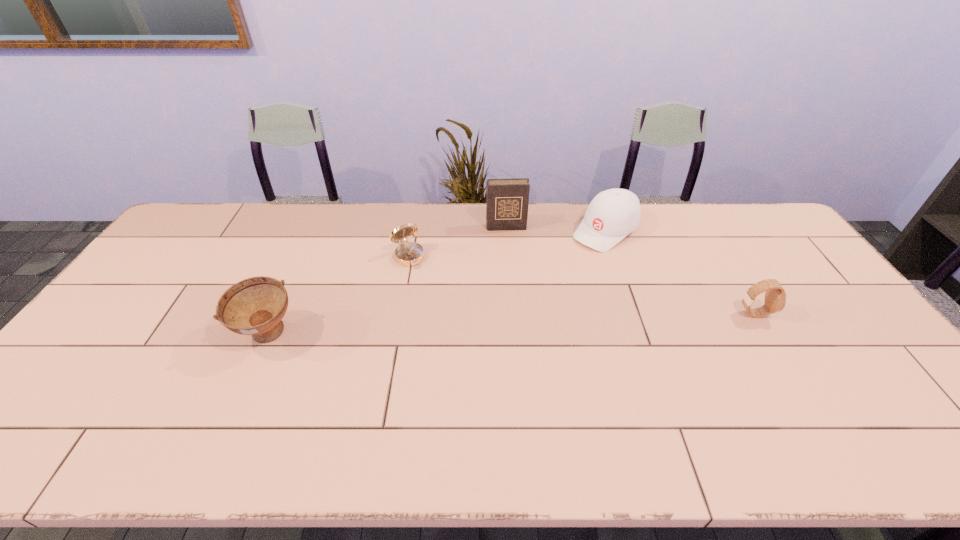
Locate an element on the screen. This screenshot has height=540, width=960. free space on the desktop that is between the soup bowl and the watch and is positioned with the dial facing the compass is located at coordinates (457, 327).

Locate an element on the screen. free spot on the desktop that is between the leftmost object and the watch and is positioned on the front-facing side of the baseball cap is located at coordinates (487, 326).

The width and height of the screenshot is (960, 540). Find the location of `free space on the desktop that is between the leftmost object and the watch and is positioned on the front cover of the diary`. free space on the desktop that is between the leftmost object and the watch and is positioned on the front cover of the diary is located at coordinates (518, 325).